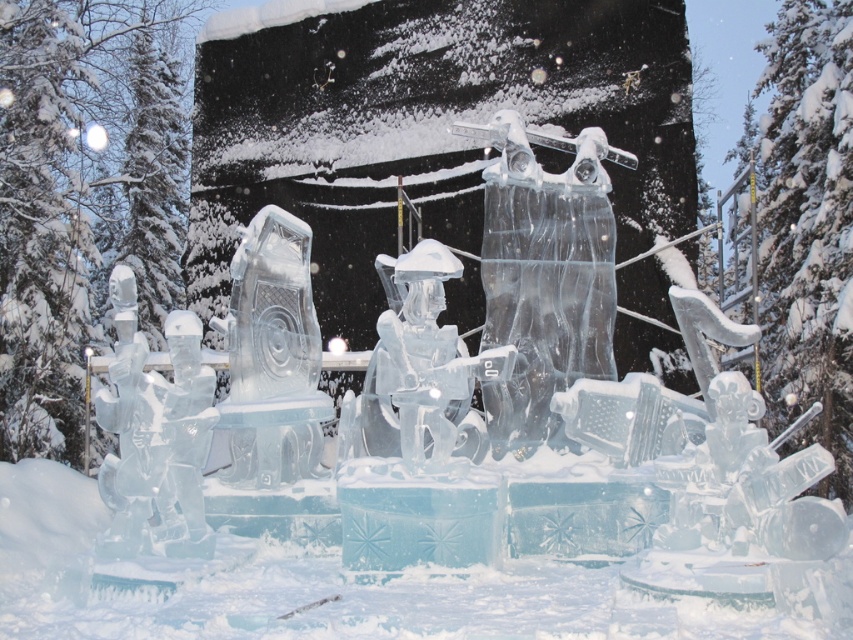
Question: Which point is closer to the camera?

Choices:
 (A) transparent ice snow at center
 (B) transparent ice figure at center
 (C) clear ice harp at center

Answer: (A)

Question: Which point is farther to the camera?

Choices:
 (A) (328, 611)
 (B) (492, 396)

Answer: (B)

Question: Does clear ice harp at center appear over transparent ice figure at center?

Choices:
 (A) yes
 (B) no

Answer: (B)

Question: Which of the following is the closest to the observer?

Choices:
 (A) transparent ice snow at center
 (B) transparent ice figure at center

Answer: (A)

Question: Can you confirm if transparent ice snow at center is positioned above transparent ice figure at center?

Choices:
 (A) no
 (B) yes

Answer: (A)

Question: Can you confirm if transparent ice snow at center is smaller than transparent ice figure at center?

Choices:
 (A) yes
 (B) no

Answer: (B)